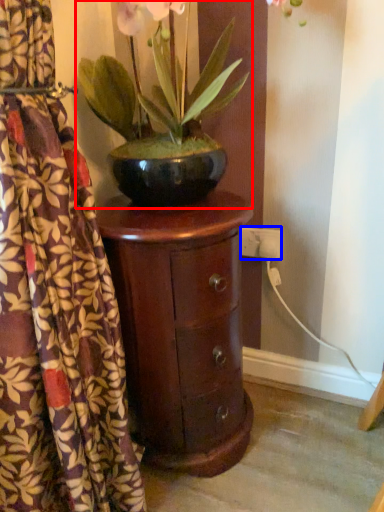
Question: Among these objects, which one is farthest to the camera, houseplant (highlighted by a red box) or electric outlet (highlighted by a blue box)?

Choices:
 (A) houseplant
 (B) electric outlet

Answer: (B)